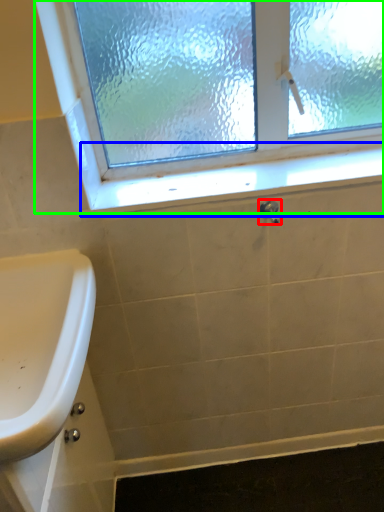
Question: Which object is positioned closest to plumbing fixture (highlighted by a red box)? Select from window sill (highlighted by a blue box) and window (highlighted by a green box).

Choices:
 (A) window sill
 (B) window

Answer: (A)